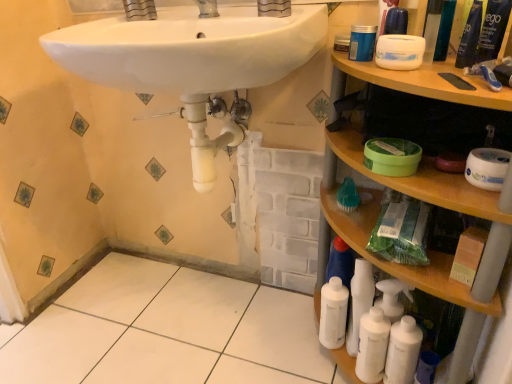
Find the location of a particular element. free region on the left part of blue glossy tube at upper right, which is counted as the 2th cleaning product, starting from the bottom is located at coordinates (406, 71).